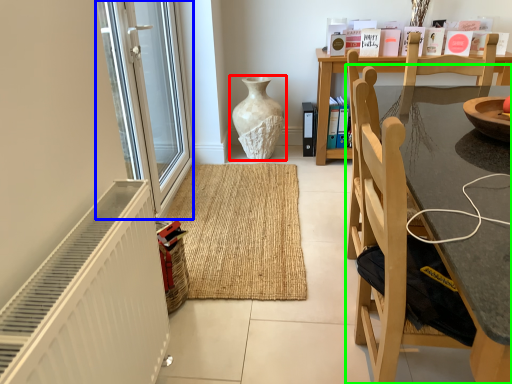
Question: Based on their relative distances, which object is farther from vase (highlighted by a red box)? Choose from screen door (highlighted by a blue box) and chair (highlighted by a green box).

Choices:
 (A) screen door
 (B) chair

Answer: (B)